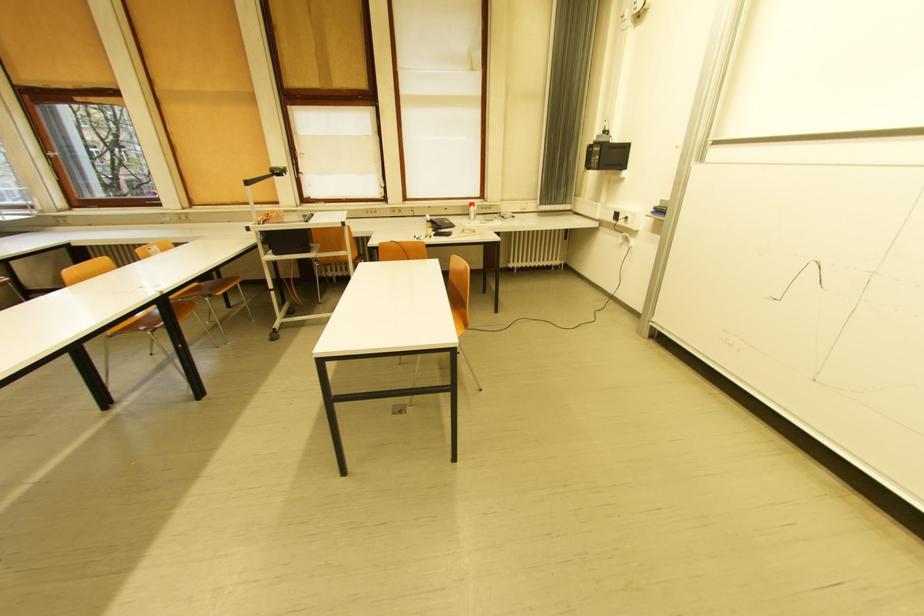
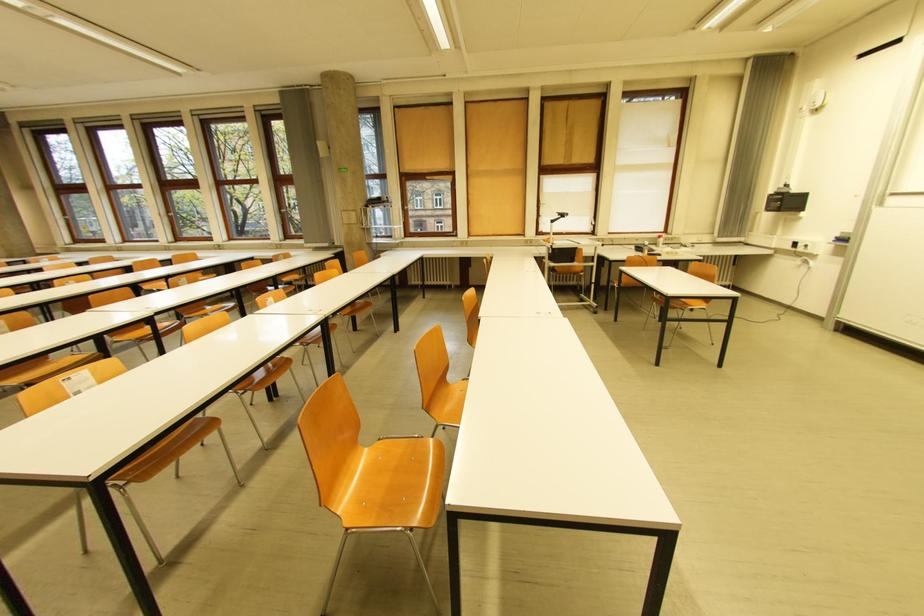
Looking at this image, what movement of the cameraman would produce the second image?

The cameraman walked toward left, backward.